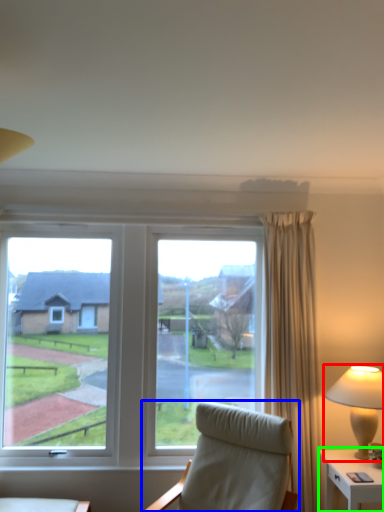
Question: Considering the real-world distances, which object is closest to lamp (highlighted by a red box)? chair (highlighted by a blue box) or nightstand (highlighted by a green box).

Choices:
 (A) chair
 (B) nightstand

Answer: (B)